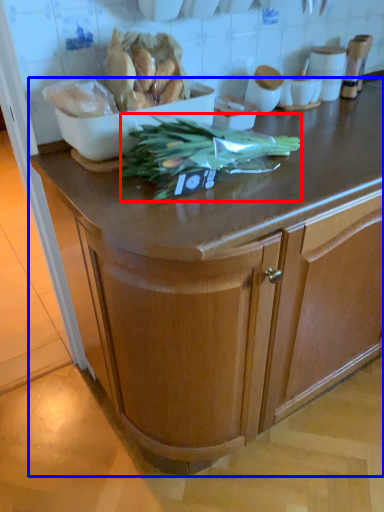
Question: Which point is closer to the camera, vegetable (highlighted by a red box) or cabinetry (highlighted by a blue box)?

Choices:
 (A) vegetable
 (B) cabinetry

Answer: (B)